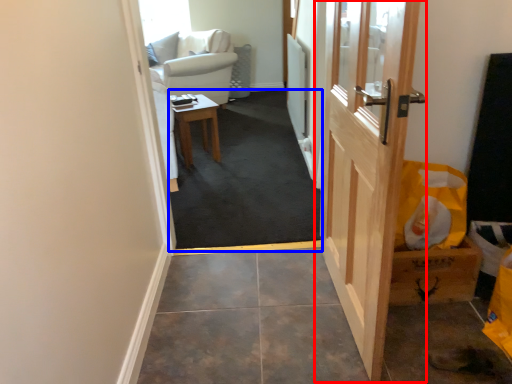
Question: Which object is closer to the camera taking this photo, door (highlighted by a red box) or corridor (highlighted by a blue box)?

Choices:
 (A) door
 (B) corridor

Answer: (A)